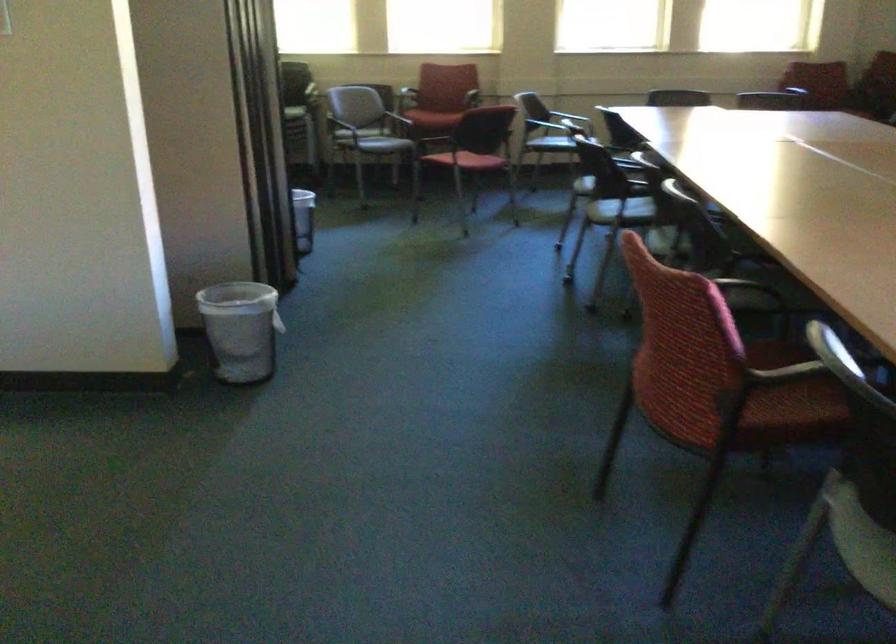
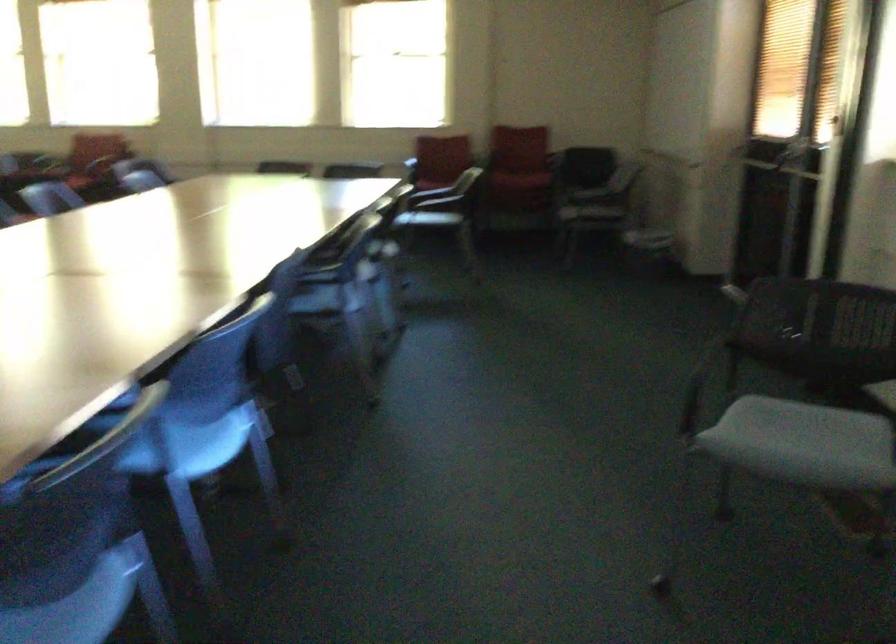
Question: The images are taken continuously from a first-person perspective. In which direction are you moving?

Choices:
 (A) Left
 (B) Right
 (C) Forward
 (D) Backward

Answer: (B)